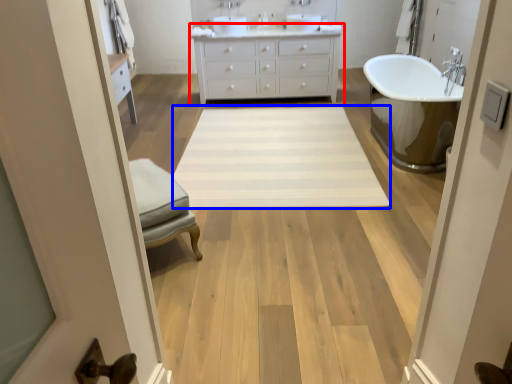
Question: Which object appears closest to the camera in this image, bathroom cabinet (highlighted by a red box) or plain (highlighted by a blue box)?

Choices:
 (A) bathroom cabinet
 (B) plain

Answer: (B)